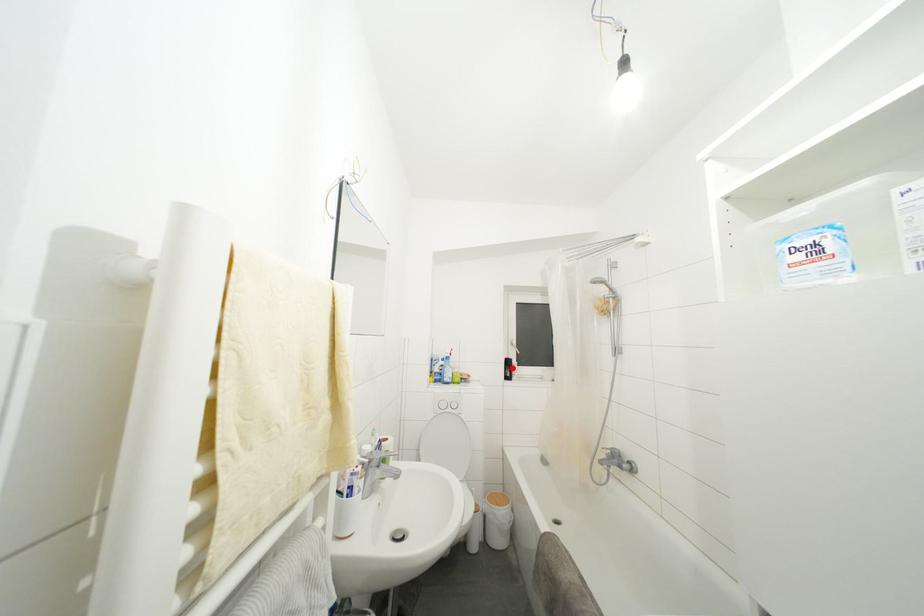
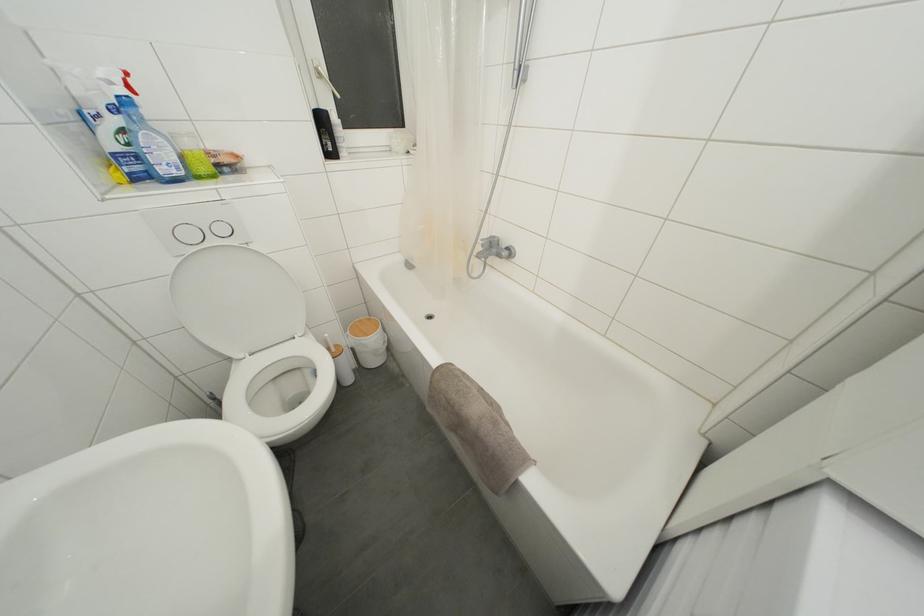
Question: I am providing you with two images of the same scene from different viewpoints. A red point is shown in image1. For the corresponding object point in image2, is it positioned nearer or farther from the camera?

Choices:
 (A) Nearer
 (B) Farther

Answer: (A)